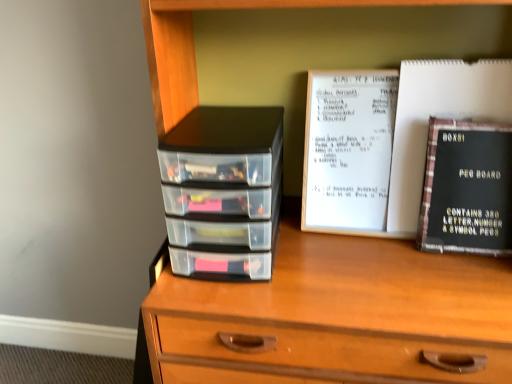
Question: Is black matte peg board at right positioned far away from wooden chest of drawers at center?

Choices:
 (A) yes
 (B) no

Answer: (B)

Question: Considering the relative sizes of black matte peg board at right and wooden chest of drawers at center in the image provided, is black matte peg board at right wider than wooden chest of drawers at center?

Choices:
 (A) no
 (B) yes

Answer: (A)

Question: Can you confirm if black matte peg board at right is shorter than wooden chest of drawers at center?

Choices:
 (A) yes
 (B) no

Answer: (A)

Question: Is black matte peg board at right oriented towards wooden chest of drawers at center?

Choices:
 (A) no
 (B) yes

Answer: (B)

Question: Is black matte peg board at right taller than wooden chest of drawers at center?

Choices:
 (A) no
 (B) yes

Answer: (A)

Question: Is the depth of black matte peg board at right greater than that of wooden chest of drawers at center?

Choices:
 (A) yes
 (B) no

Answer: (A)

Question: Can you confirm if black matte peg board at right is thinner than wooden chest of drawers at center?

Choices:
 (A) no
 (B) yes

Answer: (B)

Question: Is wooden chest of drawers at center at the back of black matte peg board at right?

Choices:
 (A) yes
 (B) no

Answer: (A)

Question: Does black matte peg board at right come behind wooden chest of drawers at center?

Choices:
 (A) no
 (B) yes

Answer: (B)

Question: Can you confirm if black matte peg board at right is smaller than wooden chest of drawers at center?

Choices:
 (A) no
 (B) yes

Answer: (B)

Question: From a real-world perspective, is black matte peg board at right located higher than wooden chest of drawers at center?

Choices:
 (A) yes
 (B) no

Answer: (A)

Question: Considering the relative sizes of black matte peg board at right and wooden chest of drawers at center in the image provided, is black matte peg board at right wider than wooden chest of drawers at center?

Choices:
 (A) no
 (B) yes

Answer: (A)

Question: Can you confirm if transparent plastic drawers at left is bigger than black matte peg board at right?

Choices:
 (A) yes
 (B) no

Answer: (A)